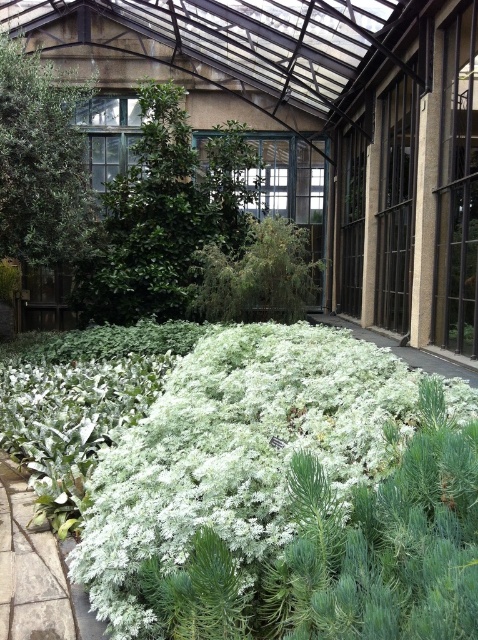
Question: Among these objects, which one is nearest to the camera?

Choices:
 (A) white fluffy plant at center
 (B) green fuzzy bush at center

Answer: (A)

Question: Where is white fluffy plant at center located in relation to green fuzzy bush at center in the image?

Choices:
 (A) left
 (B) right

Answer: (B)

Question: Can you confirm if white fluffy plant at center is positioned to the right of green fuzzy bush at center?

Choices:
 (A) no
 (B) yes

Answer: (B)

Question: Which point is closer to the camera?

Choices:
 (A) white fluffy plant at center
 (B) green fuzzy bush at center

Answer: (A)

Question: Is white fluffy plant at center above green fuzzy bush at center?

Choices:
 (A) no
 (B) yes

Answer: (A)